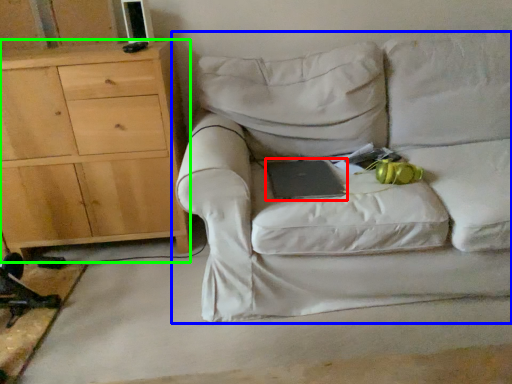
Question: Which object is positioned closest to paperback book (highlighted by a red box)? Select from studio couch (highlighted by a blue box) and chest of drawers (highlighted by a green box).

Choices:
 (A) studio couch
 (B) chest of drawers

Answer: (A)